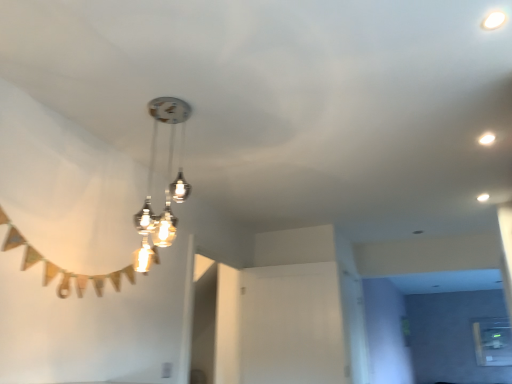
Question: From a real-world perspective, is metallic glass chandelier at center over transparent glass window at lower right?

Choices:
 (A) no
 (B) yes

Answer: (B)

Question: Is metallic glass chandelier at center facing towards transparent glass window at lower right?

Choices:
 (A) no
 (B) yes

Answer: (A)

Question: From the image's perspective, does metallic glass chandelier at center appear lower than transparent glass window at lower right?

Choices:
 (A) no
 (B) yes

Answer: (A)

Question: Does metallic glass chandelier at center have a lesser width compared to transparent glass window at lower right?

Choices:
 (A) yes
 (B) no

Answer: (B)

Question: Is metallic glass chandelier at center outside transparent glass window at lower right?

Choices:
 (A) no
 (B) yes

Answer: (B)

Question: From a real-world perspective, is metallic glass chandelier at center beneath transparent glass window at lower right?

Choices:
 (A) yes
 (B) no

Answer: (B)

Question: Considering the relative positions of white glossy droplight at upper right and transparent glass window at lower right in the image provided, is white glossy droplight at upper right to the right of transparent glass window at lower right from the viewer's perspective?

Choices:
 (A) no
 (B) yes

Answer: (A)

Question: From a real-world perspective, is white glossy droplight at upper right under transparent glass window at lower right?

Choices:
 (A) no
 (B) yes

Answer: (A)

Question: From the image's perspective, is white glossy droplight at upper right on top of transparent glass window at lower right?

Choices:
 (A) no
 (B) yes

Answer: (B)

Question: Is white glossy droplight at upper right positioned with its back to transparent glass window at lower right?

Choices:
 (A) yes
 (B) no

Answer: (B)

Question: Can you confirm if white glossy droplight at upper right is shorter than transparent glass window at lower right?

Choices:
 (A) no
 (B) yes

Answer: (B)

Question: Is white glossy droplight at upper right in front of transparent glass window at lower right?

Choices:
 (A) no
 (B) yes

Answer: (B)

Question: Would you say white glossy droplight at upper right is part of transparent glass window at lower right's contents?

Choices:
 (A) yes
 (B) no

Answer: (B)